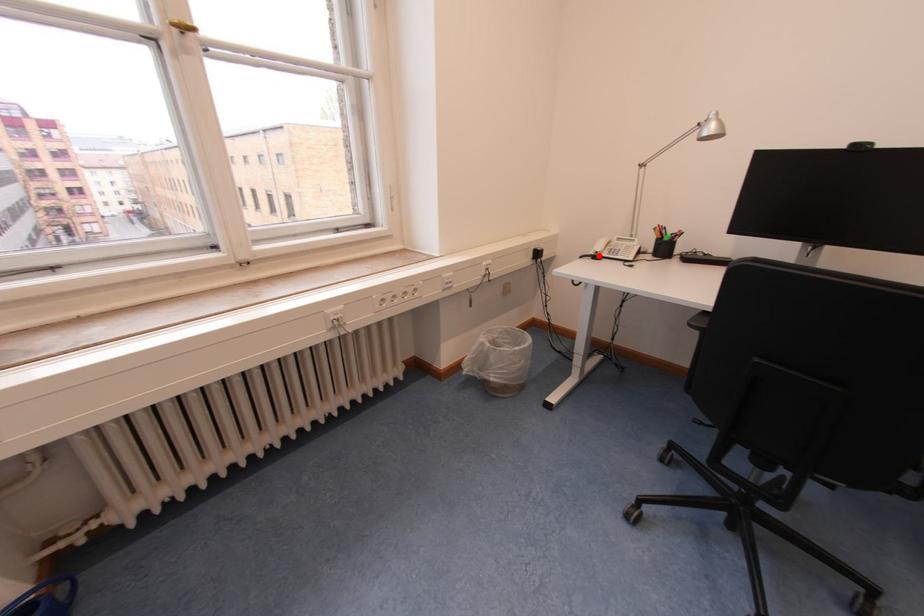
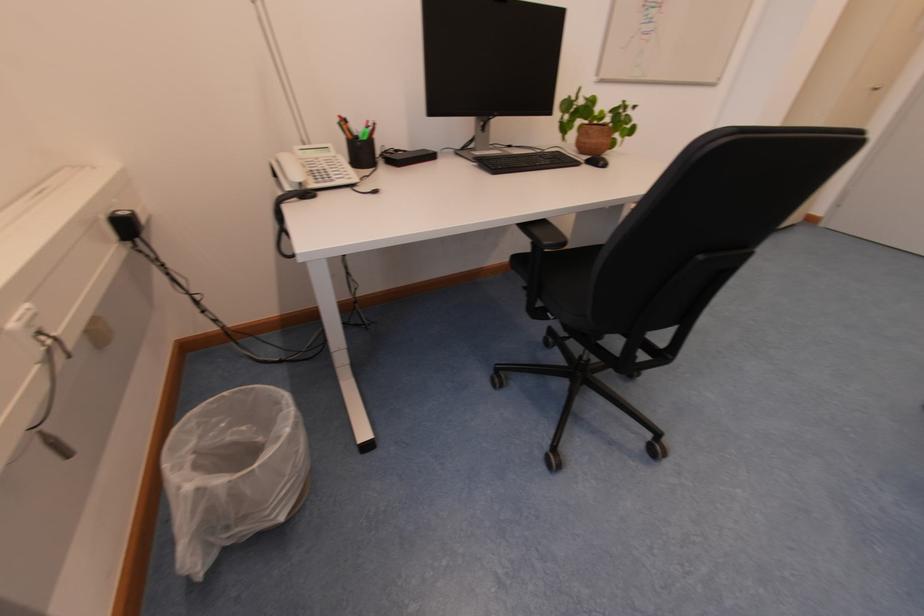
Find the pixel in the second image that matches the highlighted location in the first image.

(296, 191)